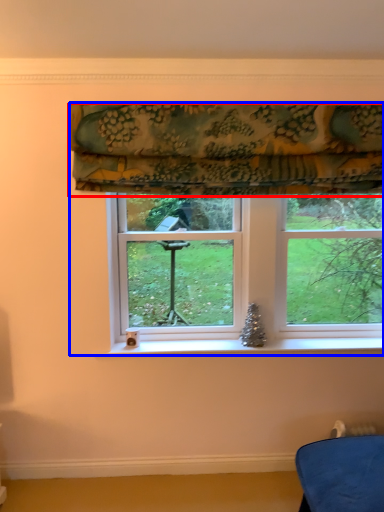
Question: Which of the following is the farthest to the observer, curtain (highlighted by a red box) or window (highlighted by a blue box)?

Choices:
 (A) curtain
 (B) window

Answer: (B)